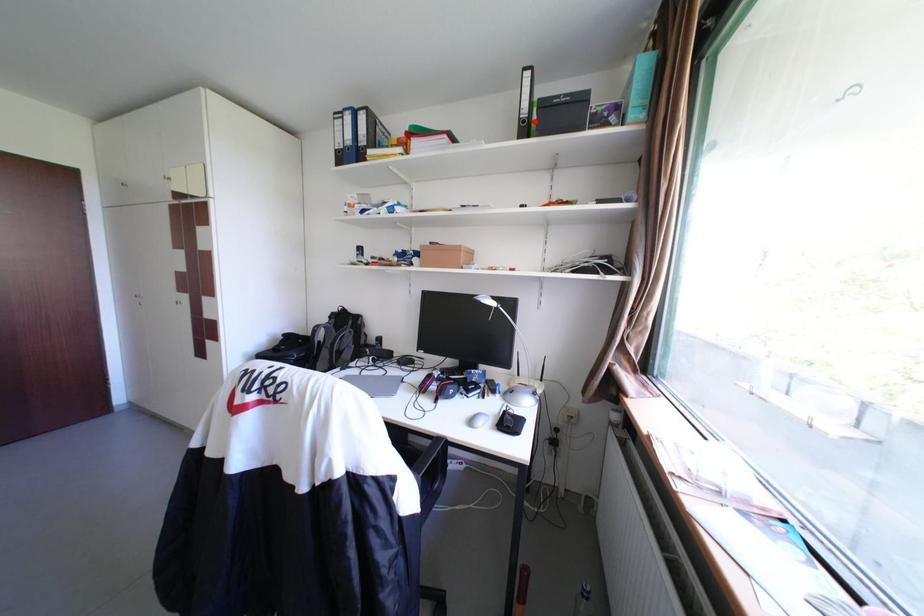
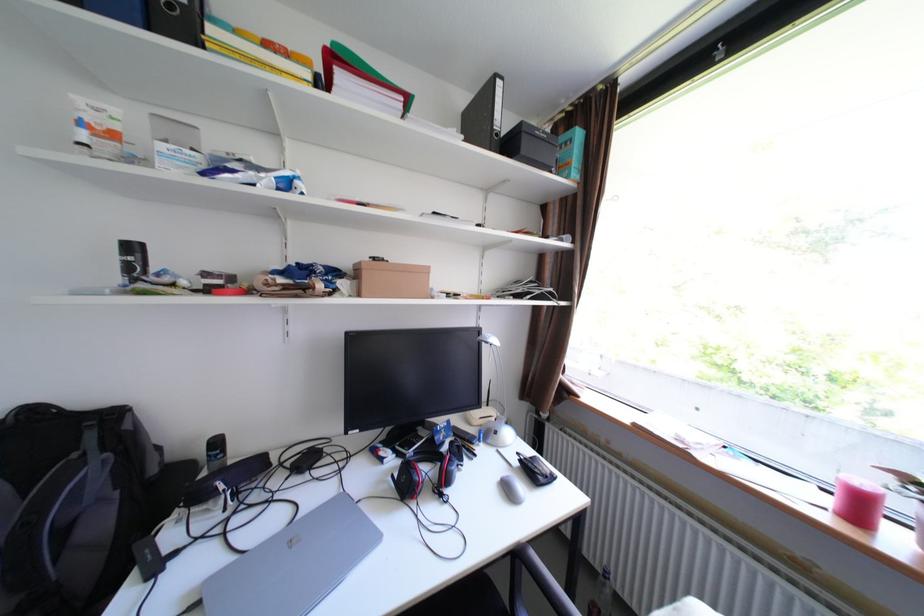
In the second image, find the point that corresponds to the highlighted location in the first image.

(507, 135)